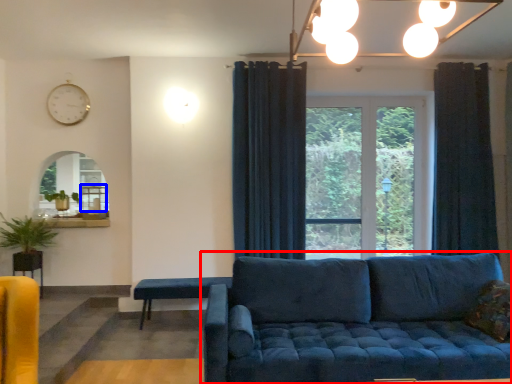
Question: Which point is closer to the camera, studio couch (highlighted by a red box) or table (highlighted by a blue box)?

Choices:
 (A) studio couch
 (B) table

Answer: (A)